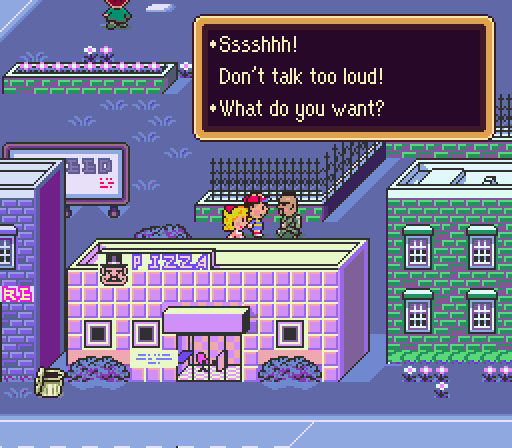
You are a GUI agent. You are given a task and a screenshot of the screen. Output one action in this format:
    pyautogui.click(x=<x>, y=<y>)
    Task: Click on the door
    This screenshot has width=512, height=448.
    Given the screenshot: What is the action you would take?
    pyautogui.click(x=219, y=362)